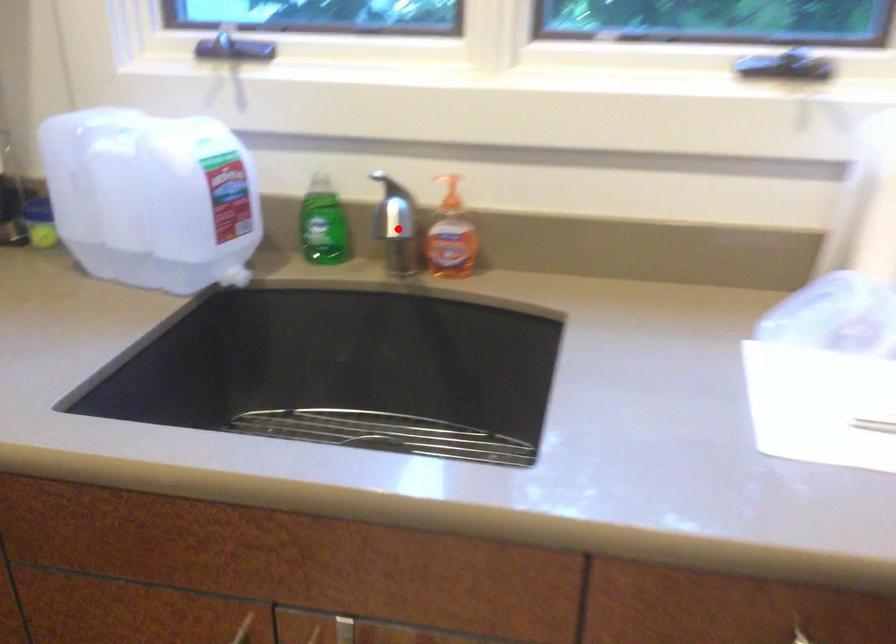
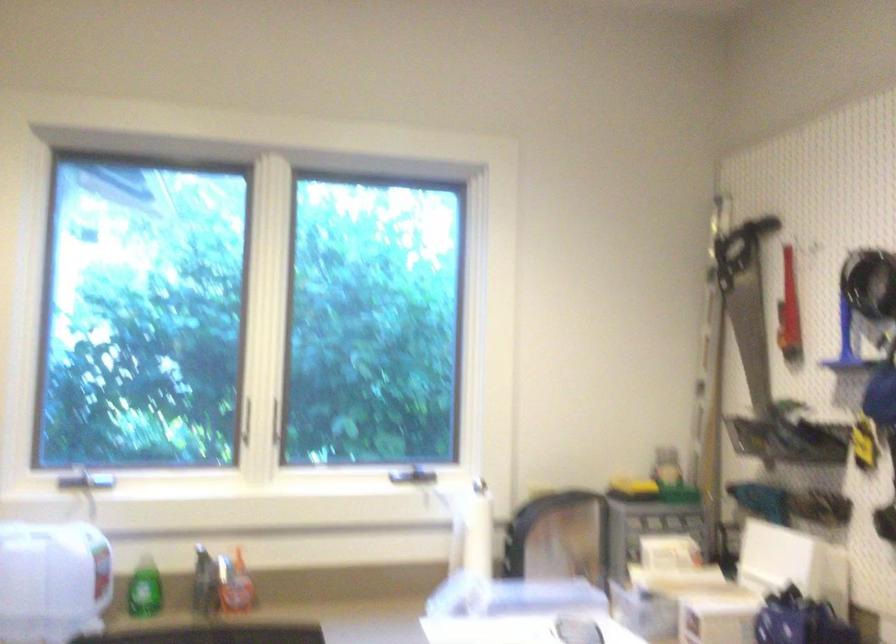
Question: I am providing you with two images of the same scene from different viewpoints. Image1 has a red point marked. In image2, the corresponding 3D location appears at what relative position? Reply with the corresponding letter.

Choices:
 (A) Closer
 (B) Farther

Answer: (B)